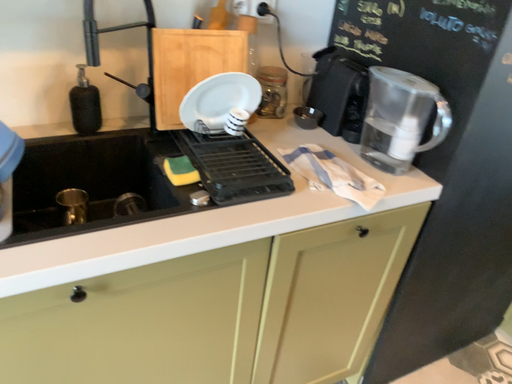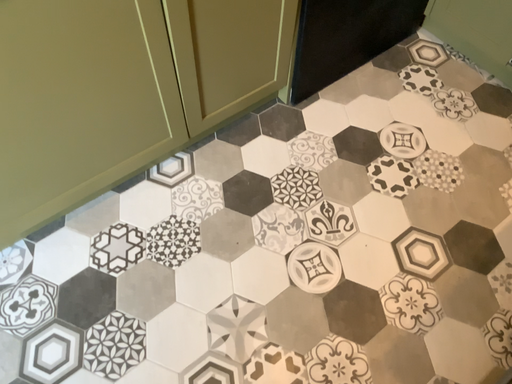
Question: Which way did the camera rotate in the video?

Choices:
 (A) rotated downward
 (B) rotated upward

Answer: (A)